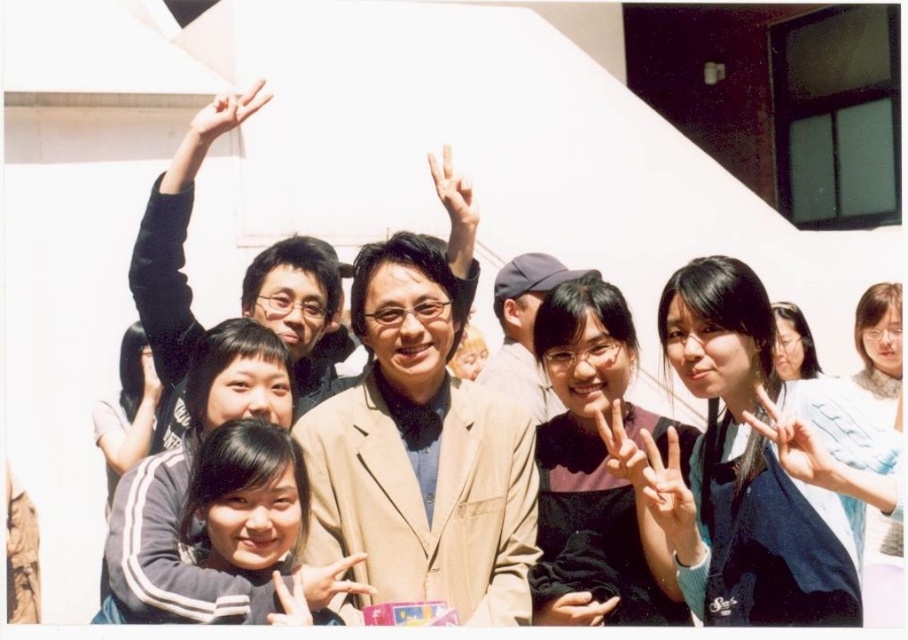
Question: Which point appears farthest from the camera in this image?

Choices:
 (A) (242, 93)
 (B) (140, 397)
 (C) (551, 600)
 (D) (706, 433)

Answer: (A)

Question: Considering the real-world distances, which object is farthest from the beige fabric jacket at center?

Choices:
 (A) light blue fabric hand at center right
 (B) matte beige suit at center

Answer: (A)

Question: Which of the following is the closest to the observer?

Choices:
 (A) (471, 189)
 (B) (323, 605)
 (C) (143, 356)
 (D) (304, 273)

Answer: (B)

Question: In this image, where is smooth black hair at center located relative to matte beige hand at lower center?

Choices:
 (A) above
 (B) below

Answer: (A)

Question: Can you confirm if matte beige suit at center is positioned above matte black hand at lower center?

Choices:
 (A) yes
 (B) no

Answer: (A)

Question: In this image, where is light blue fabric hand at center right located relative to white matte hand at center?

Choices:
 (A) right
 (B) left

Answer: (A)